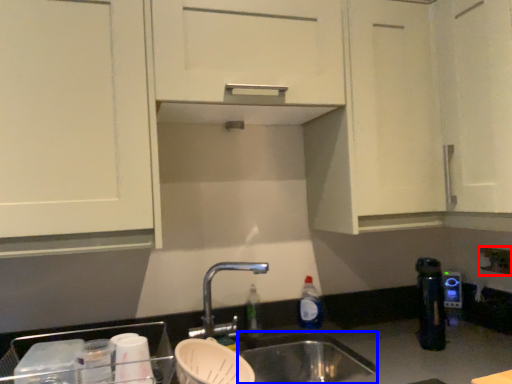
Question: Which object is closer to the camera taking this photo, electric outlet (highlighted by a red box) or sink (highlighted by a blue box)?

Choices:
 (A) electric outlet
 (B) sink

Answer: (B)